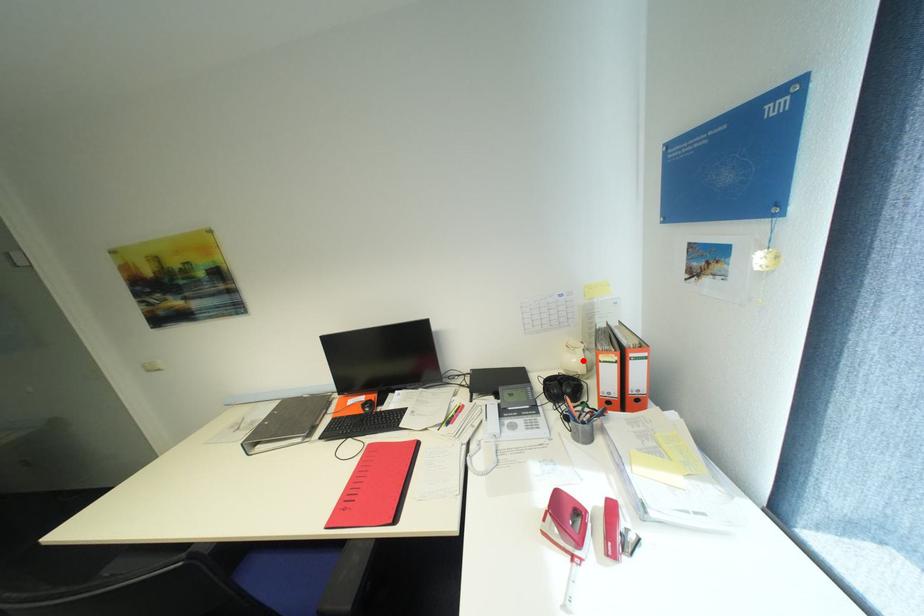
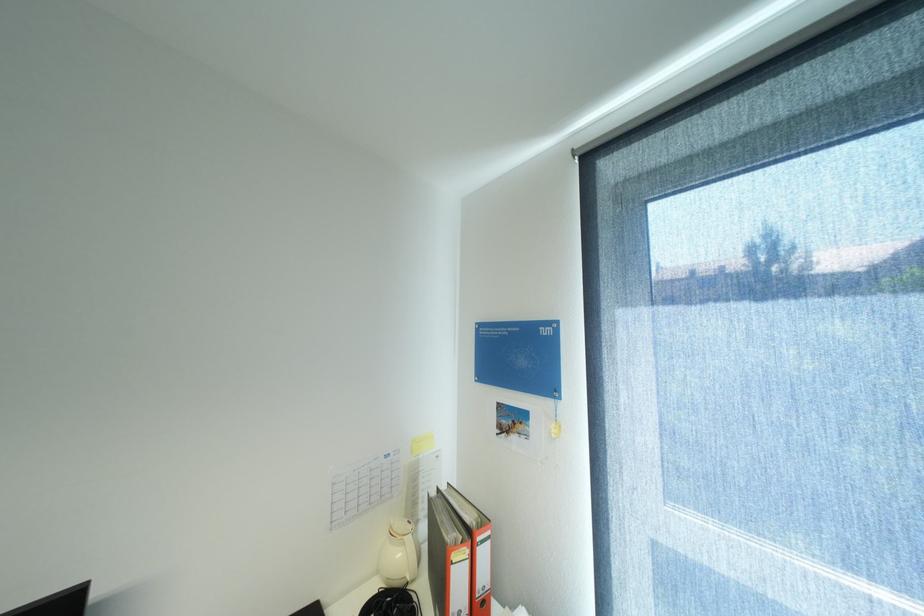
Question: I am providing you with two images of the same scene from different viewpoints. A red point is marked on the first image. Can you still see the location of the red point in image 2?

Choices:
 (A) Yes
 (B) No

Answer: (A)